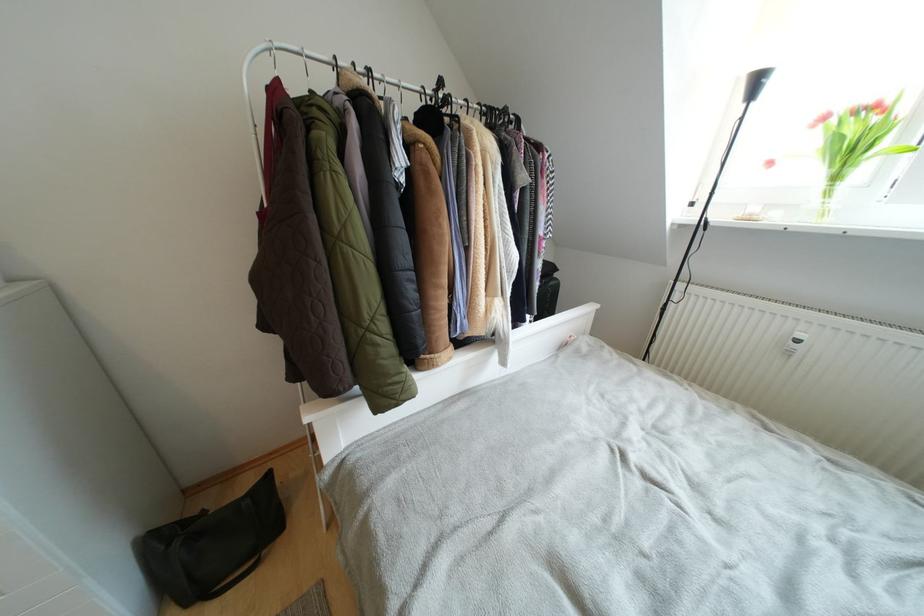
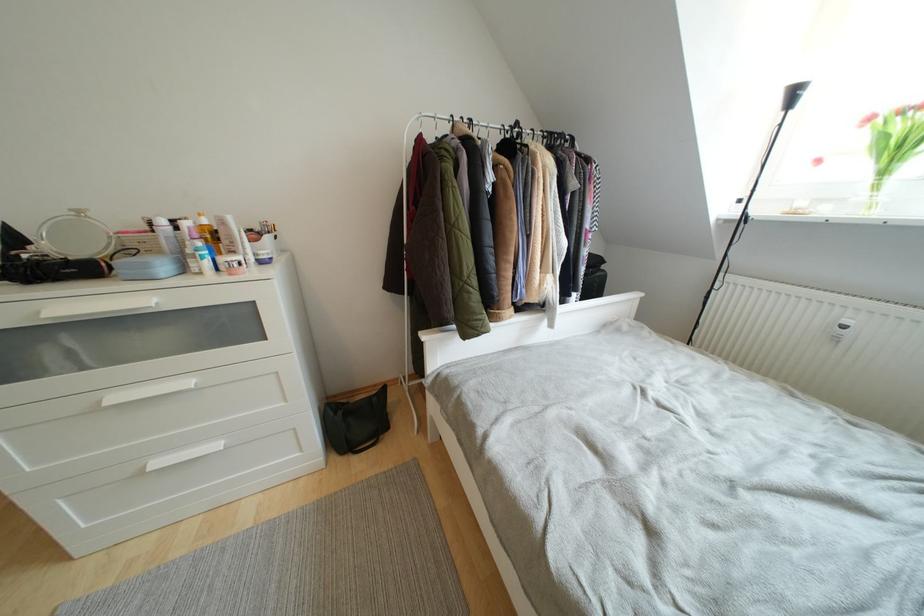
Question: The camera is either moving clockwise (left) or counter-clockwise (right) around the object. The first image is from the beginning of the video and the second image is from the end. Is the camera moving left or right when shooting the video?

Choices:
 (A) Left
 (B) Right

Answer: (B)